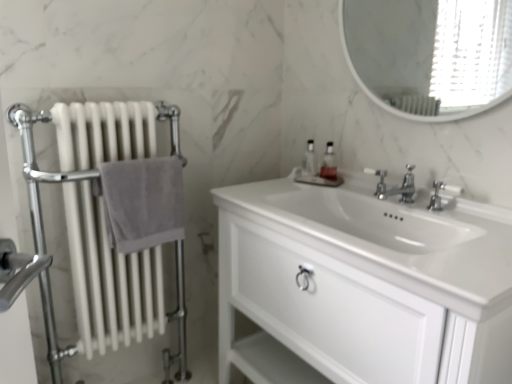
Where is `vacant area that lies between translucent glass soap dispenser at center, which appears as the 2th soap dispenser when viewed from the right, and polished chrome faucet at center`? The image size is (512, 384). vacant area that lies between translucent glass soap dispenser at center, which appears as the 2th soap dispenser when viewed from the right, and polished chrome faucet at center is located at coordinates (345, 192).